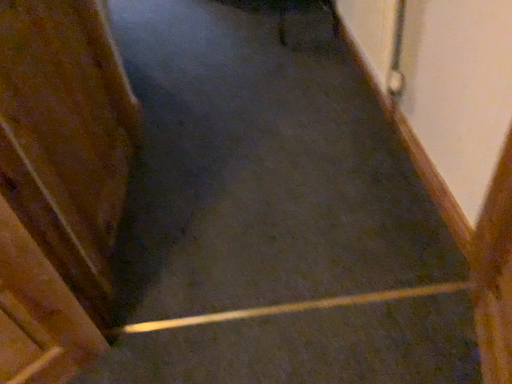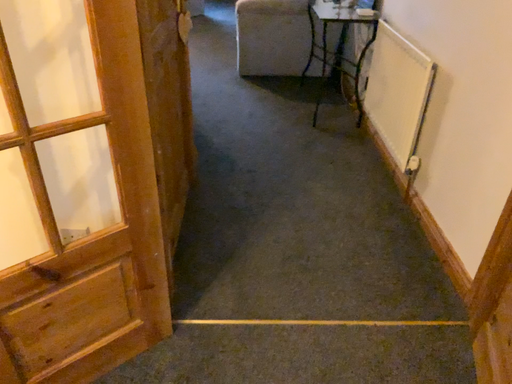
Question: Which way did the camera rotate in the video?

Choices:
 (A) rotated downward
 (B) rotated upward

Answer: (B)